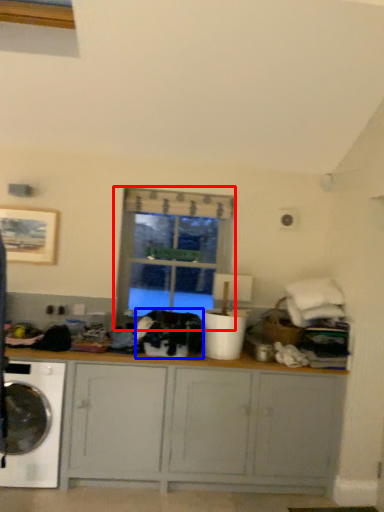
Question: Among these objects, which one is farthest to the camera, window (highlighted by a red box) or clothing (highlighted by a blue box)?

Choices:
 (A) window
 (B) clothing

Answer: (A)